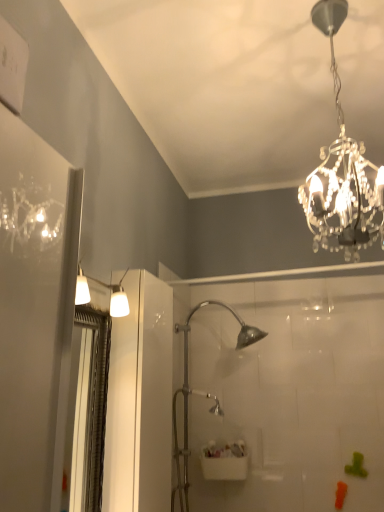
Question: From a real-world perspective, is clear crystal chandelier at upper right positioned under white plastic sink at center based on gravity?

Choices:
 (A) yes
 (B) no

Answer: (B)

Question: Is clear crystal chandelier at upper right oriented away from white plastic sink at center?

Choices:
 (A) yes
 (B) no

Answer: (B)

Question: Is clear crystal chandelier at upper right shorter than white plastic sink at center?

Choices:
 (A) no
 (B) yes

Answer: (A)

Question: Is clear crystal chandelier at upper right positioned far away from white plastic sink at center?

Choices:
 (A) no
 (B) yes

Answer: (B)

Question: Considering the relative sizes of clear crystal chandelier at upper right and white plastic sink at center in the image provided, is clear crystal chandelier at upper right wider than white plastic sink at center?

Choices:
 (A) no
 (B) yes

Answer: (B)

Question: From the image's perspective, is white plastic sink at center above or below clear crystal chandelier at upper right?

Choices:
 (A) above
 (B) below

Answer: (B)

Question: Is white plastic sink at center to the left or to the right of clear crystal chandelier at upper right in the image?

Choices:
 (A) right
 (B) left

Answer: (B)

Question: Based on their sizes in the image, would you say white plastic sink at center is bigger or smaller than clear crystal chandelier at upper right?

Choices:
 (A) small
 (B) big

Answer: (A)

Question: From a real-world perspective, relative to clear crystal chandelier at upper right, is white plastic sink at center vertically above or below?

Choices:
 (A) below
 (B) above

Answer: (A)

Question: From the image's perspective, is clear plastic screen door at left positioned above or below clear crystal chandelier at upper right?

Choices:
 (A) below
 (B) above

Answer: (A)

Question: Considering the positions of clear plastic screen door at left and clear crystal chandelier at upper right in the image, is clear plastic screen door at left wider or thinner than clear crystal chandelier at upper right?

Choices:
 (A) thin
 (B) wide

Answer: (A)

Question: From a real-world perspective, is clear plastic screen door at left physically located above or below clear crystal chandelier at upper right?

Choices:
 (A) above
 (B) below

Answer: (B)

Question: Is clear plastic screen door at left spatially inside clear crystal chandelier at upper right, or outside of it?

Choices:
 (A) inside
 (B) outside

Answer: (B)

Question: Considering their positions, is clear crystal chandelier at upper right located in front of or behind white plastic sink at center?

Choices:
 (A) front
 (B) behind

Answer: (A)

Question: Is point (339, 216) closer or farther from the camera than point (205, 462)?

Choices:
 (A) closer
 (B) farther

Answer: (A)